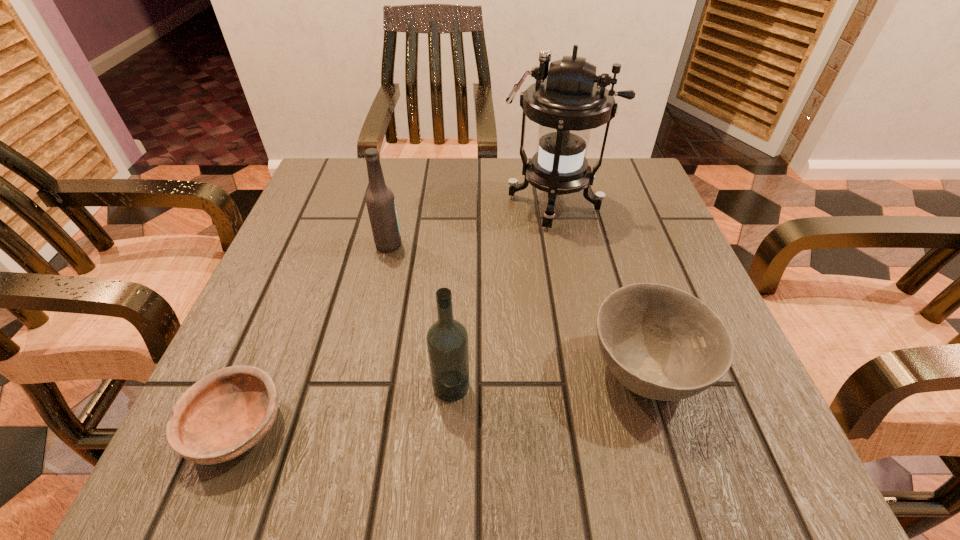
You are a GUI agent. You are given a task and a screenshot of the screen. Output one action in this format:
    pyautogui.click(x=<x>, y=<y>)
    Task: Click on the vacant area in the image that satisfies the following two spatial constraints: 1. on the label of the beer bottle; 2. on the right side of the second shortest object
    
    Given the screenshot: What is the action you would take?
    pyautogui.click(x=360, y=373)

You are a GUI agent. You are given a task and a screenshot of the screen. Output one action in this format:
    pyautogui.click(x=<x>, y=<y>)
    Task: Click on the vacant area in the image that satisfies the following two spatial constraints: 1. on the front side of the tallest object; 2. on the label of the fourth nearest object
    Image resolution: width=960 pixels, height=540 pixels.
    Given the screenshot: What is the action you would take?
    pyautogui.click(x=561, y=245)

The width and height of the screenshot is (960, 540). I want to click on free space that satisfies the following two spatial constraints: 1. on the back side of the third object from right to left; 2. on the left side of the leftmost object, so click(255, 386).

Find the location of a particular element. free space that satisfies the following two spatial constraints: 1. on the front side of the taller bowl; 2. on the right side of the lantern is located at coordinates (587, 373).

Identify the location of free region that satisfies the following two spatial constraints: 1. on the back side of the fourth tallest object; 2. on the left side of the leftmost object. Image resolution: width=960 pixels, height=540 pixels. (260, 373).

At what (x,y) coordinates should I click in order to perform the action: click on free spot that satisfies the following two spatial constraints: 1. on the back side of the farthest object; 2. on the right side of the third object from right to left. Please return your answer as a coordinate pair (x, y). The height and width of the screenshot is (540, 960). Looking at the image, I should click on (461, 204).